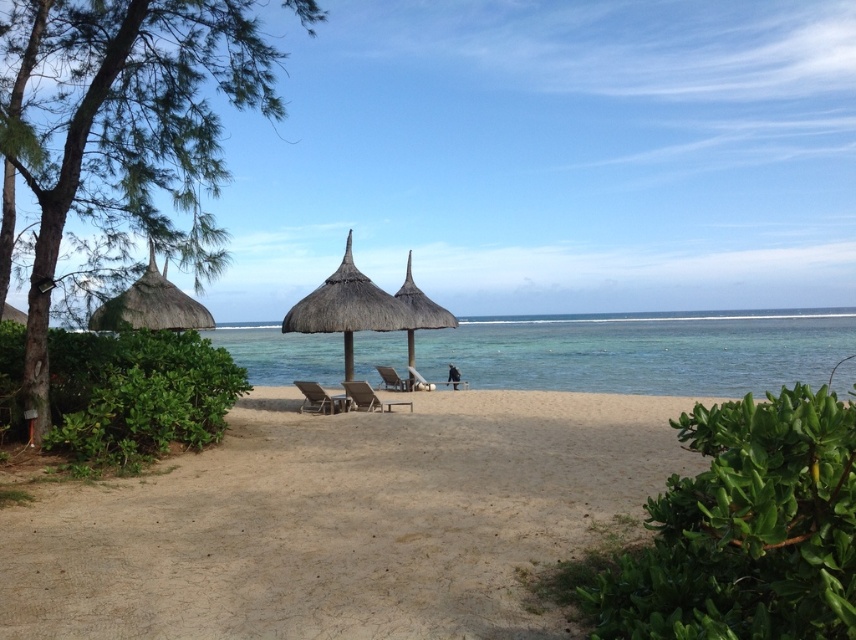
Question: Estimate the real-world distances between objects in this image. Which object is farther from the wooden beach chair at center?

Choices:
 (A) dark brown textured beach chair at center
 (B) beige sandy beach at center

Answer: (B)

Question: Which point is closer to the camera?

Choices:
 (A) natural thatch umbrella at center
 (B) beige sandy beach at center
 (C) wooden beach chair at center
 (D) dark brown textured beach chair at center

Answer: (B)

Question: Where is wooden beach chair at center located in relation to dark brown woven beach chair at center in the image?

Choices:
 (A) left
 (B) right

Answer: (B)

Question: Is thatched straw umbrella at center positioned before wooden beach chair at center?

Choices:
 (A) yes
 (B) no

Answer: (B)

Question: Can you confirm if natural thatch umbrella at center is positioned to the left of dark brown woven beach chair at center?

Choices:
 (A) yes
 (B) no

Answer: (B)

Question: Which of the following is the closest to the observer?

Choices:
 (A) clear blue water at center
 (B) natural thatch umbrella at center

Answer: (A)